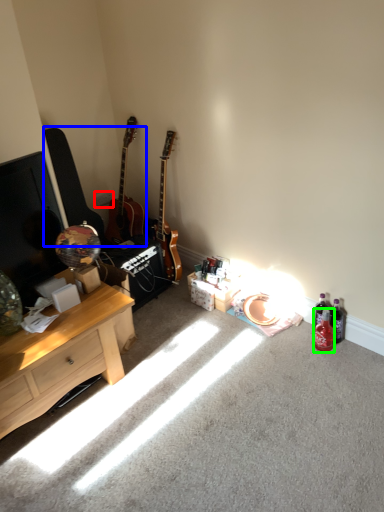
Question: Based on their relative distances, which object is farther from power outlet (highlighted by a red box)? Choose from guitars (highlighted by a blue box) and bottle (highlighted by a green box).

Choices:
 (A) guitars
 (B) bottle

Answer: (B)